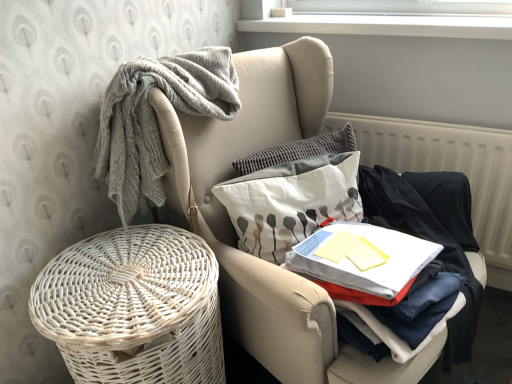
Question: Relative to white wicker basket at lower left, is white fabric pillow with gray floral pattern at center in front or behind?

Choices:
 (A) behind
 (B) front

Answer: (A)

Question: Is point (354, 188) closer or farther from the camera than point (212, 137)?

Choices:
 (A) closer
 (B) farther

Answer: (A)

Question: Considering the real-world distances, which object is closest to the white fabric pillow with gray floral pattern at center?

Choices:
 (A) textured gray pillow at center
 (B) white textured radiator at right
 (C) white wicker basket at lower left
 (D) white wicker basket at lower left
 (E) dark blue cotton shirt at right

Answer: (A)

Question: Which object is the closest to the textured gray pillow at center?

Choices:
 (A) white wicker basket at lower left
 (B) white textured radiator at right
 (C) white wicker basket at lower left
 (D) white fabric pillow with gray floral pattern at center
 (E) dark blue cotton shirt at right

Answer: (D)